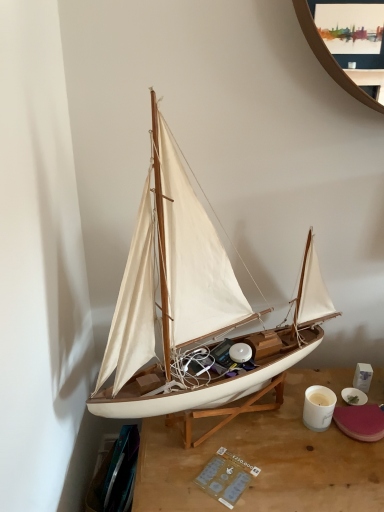
Question: Is white matte sailboat at center aimed at white glossy coffee cup at lower right?

Choices:
 (A) no
 (B) yes

Answer: (A)

Question: Does white matte sailboat at center touch white glossy coffee cup at lower right?

Choices:
 (A) no
 (B) yes

Answer: (A)

Question: From the image's perspective, does white matte sailboat at center appear higher than white glossy coffee cup at lower right?

Choices:
 (A) no
 (B) yes

Answer: (B)

Question: Is white matte sailboat at center outside of white glossy coffee cup at lower right?

Choices:
 (A) no
 (B) yes

Answer: (B)

Question: Is white matte sailboat at center closer to camera compared to white glossy coffee cup at lower right?

Choices:
 (A) yes
 (B) no

Answer: (A)

Question: Is white matte sailboat at center to the left or to the right of wooden desk at center in the image?

Choices:
 (A) left
 (B) right

Answer: (A)

Question: From the image's perspective, is white matte sailboat at center above or below wooden desk at center?

Choices:
 (A) above
 (B) below

Answer: (A)

Question: Choose the correct answer: Is white matte sailboat at center inside wooden desk at center or outside it?

Choices:
 (A) outside
 (B) inside

Answer: (A)

Question: Considering the positions of white matte sailboat at center and wooden desk at center in the image, is white matte sailboat at center bigger or smaller than wooden desk at center?

Choices:
 (A) big
 (B) small

Answer: (A)

Question: Considering the positions of white glossy coffee cup at lower right and white matte sailboat at center in the image, is white glossy coffee cup at lower right taller or shorter than white matte sailboat at center?

Choices:
 (A) short
 (B) tall

Answer: (A)

Question: From a real-world perspective, is white glossy coffee cup at lower right physically located above or below white matte sailboat at center?

Choices:
 (A) below
 (B) above

Answer: (A)

Question: Would you say white glossy coffee cup at lower right is to the left or to the right of white matte sailboat at center in the picture?

Choices:
 (A) right
 (B) left

Answer: (A)

Question: Is white glossy coffee cup at lower right wider or thinner than white matte sailboat at center?

Choices:
 (A) thin
 (B) wide

Answer: (A)

Question: In terms of height, does wooden desk at center look taller or shorter compared to white glossy coffee cup at lower right?

Choices:
 (A) tall
 (B) short

Answer: (A)

Question: Considering the positions of wooden desk at center and white glossy coffee cup at lower right in the image, is wooden desk at center wider or thinner than white glossy coffee cup at lower right?

Choices:
 (A) wide
 (B) thin

Answer: (A)